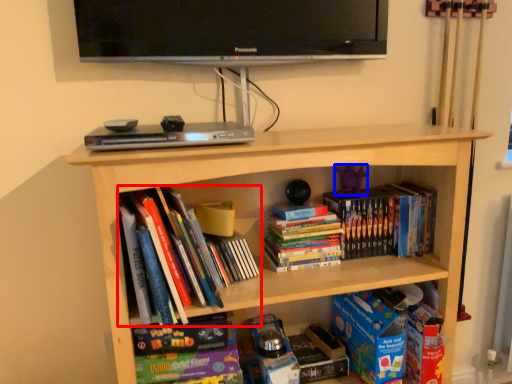
Question: Which point is further to the camera, book (highlighted by a red box) or toy (highlighted by a blue box)?

Choices:
 (A) book
 (B) toy

Answer: (B)